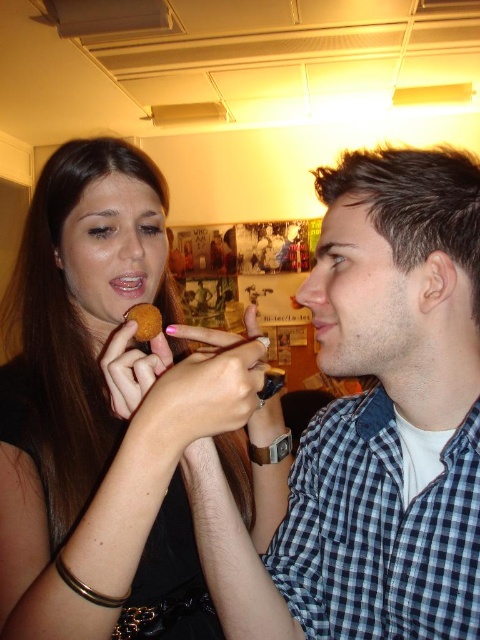
Between checkered fabric shirt at center and golden matte cookie at center, which one is positioned lower?

checkered fabric shirt at center is lower down.

Is checkered fabric shirt at center thinner than golden matte cookie at center?

No.

Which is behind, point (279, 604) or point (140, 326)?

The point (140, 326) is behind.

The width and height of the screenshot is (480, 640). Find the location of `checkered fabric shirt at center`. checkered fabric shirt at center is located at coordinates (372, 422).

Which is behind, point (338, 476) or point (124, 278)?

The point (124, 278) is behind.

In the scene shown: Is checkered fabric shirt at center to the left of matte pink lips at center from the viewer's perspective?

Incorrect, checkered fabric shirt at center is not on the left side of matte pink lips at center.

Between point (367, 540) and point (119, 280), which one is positioned in front?

Point (367, 540) is in front.

Locate an element on the screen. This screenshot has width=480, height=640. checkered fabric shirt at center is located at coordinates (372, 422).

Which is behind, point (156, 332) or point (118, 284)?

Point (118, 284)

How much distance is there between golden matte cookie at center and matte pink lips at center?

golden matte cookie at center is 2.25 inches from matte pink lips at center.

The height and width of the screenshot is (640, 480). Identify the location of golden matte cookie at center. (144, 321).